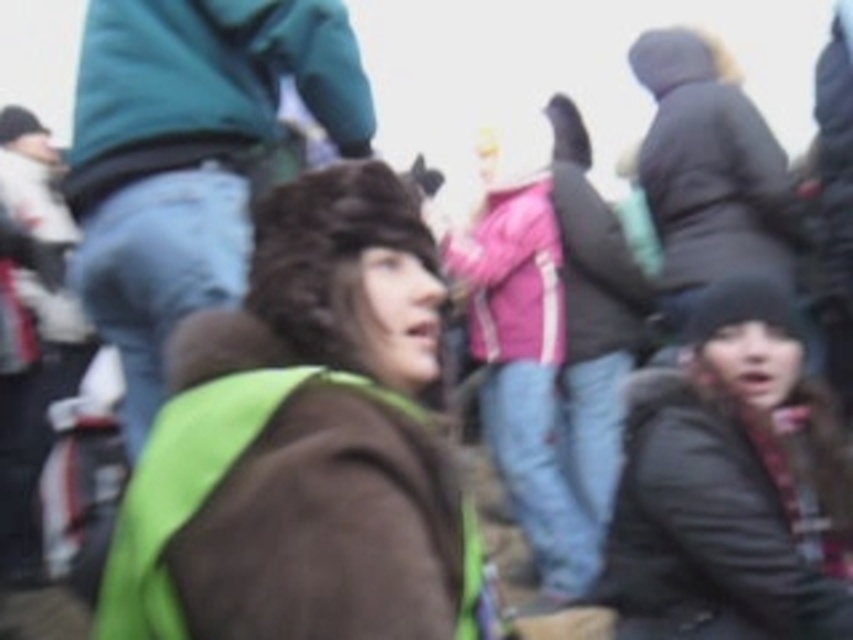
You are a photographer trying to capture a clear shot of the green fabric vest at center and the teal fleece jacket at upper left. Based on their positions, which one is closer to the camera?

The green fabric vest at center is located below the teal fleece jacket at upper left, which means it is closer to the camera since objects lower in the frame are typically nearer when the camera is at eye level.

You are a photographer trying to capture a clear image of the green fabric vest at center and the teal fleece jacket at upper left. Given that your camera has a depth of field that can focus on objects within a 3 feet range, will both items be in focus?

The green fabric vest at center is 3.49 feet from the teal fleece jacket at upper left. Since the distance between them exceeds the camera s 3 feet depth of field range, both items cannot be in focus simultaneously.

You are a photographer trying to adjust your camera to focus on the green fabric vest at center. What are the coordinates where you should aim your camera?

The green fabric vest at center is located at coordinates point (294, 452), so you should aim your camera at those coordinates to focus on it.